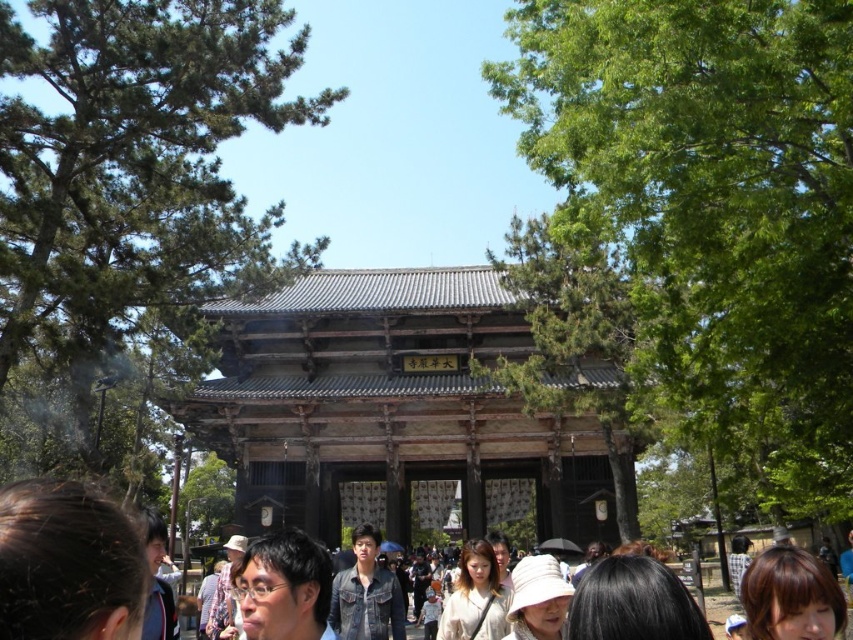
Is brown hair at lower right to the right of light brown wooden hat at lower center from the viewer's perspective?

Correct, you'll find brown hair at lower right to the right of light brown wooden hat at lower center.

Based on the photo, which is more to the right, brown hair at lower right or light brown wooden hat at lower center?

brown hair at lower right is more to the right.

Identify the location of brown hair at lower right. (791, 596).

Find the location of a particular element. brown hair at lower right is located at coordinates (791, 596).

Can you confirm if light beige cotton shirt at center is taller than dark brown leather jacket at lower left?

Incorrect, light beige cotton shirt at center's height is not larger of dark brown leather jacket at lower left's.

Is light beige cotton shirt at center to the right of dark brown leather jacket at lower left from the viewer's perspective?

Yes, light beige cotton shirt at center is to the right of dark brown leather jacket at lower left.

Who is more distant from viewer, (463, 586) or (151, 524)?

The point (463, 586) is behind.

What are the coordinates of `light beige cotton shirt at center` in the screenshot? It's located at (474, 596).

Is brown wooden temple at center above brown hair at lower left?

Indeed, brown wooden temple at center is positioned over brown hair at lower left.

In the scene shown: Does brown wooden temple at center appear on the right side of brown hair at lower left?

Indeed, brown wooden temple at center is positioned on the right side of brown hair at lower left.

Where is `brown wooden temple at center`? brown wooden temple at center is located at coordinates (387, 406).